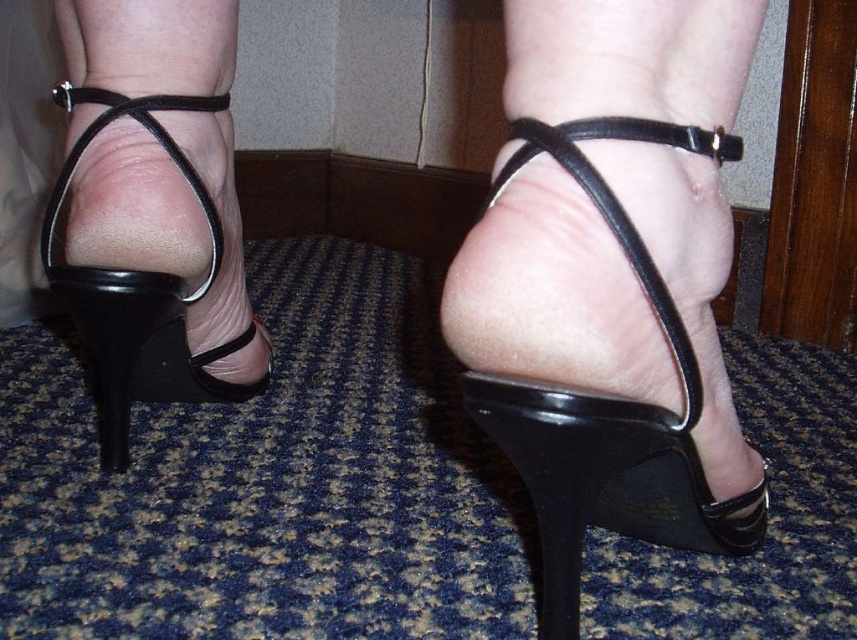
Question: Considering the relative positions of black shiny sandal at center and black leather sandal at left in the image provided, where is black shiny sandal at center located with respect to black leather sandal at left?

Choices:
 (A) above
 (B) below

Answer: (B)

Question: Is black shiny sandal at center to the right of black leather sandal at left from the viewer's perspective?

Choices:
 (A) no
 (B) yes

Answer: (B)

Question: Among these objects, which one is farthest from the camera?

Choices:
 (A) black leather sandal at left
 (B) black shiny sandal at center

Answer: (A)

Question: From the image, what is the correct spatial relationship of black shiny sandal at center in relation to black leather sandal at left?

Choices:
 (A) left
 (B) right

Answer: (B)